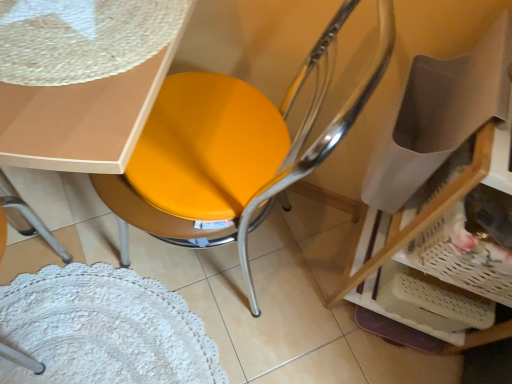
Question: From a real-world perspective, is white woven basket at lower right located higher than matte yellow seat at center?

Choices:
 (A) yes
 (B) no

Answer: (A)

Question: Does white woven basket at lower right have a larger size compared to matte yellow seat at center?

Choices:
 (A) yes
 (B) no

Answer: (B)

Question: Is white woven basket at lower right to the left of matte yellow seat at center from the viewer's perspective?

Choices:
 (A) no
 (B) yes

Answer: (A)

Question: Considering the relative sizes of white woven basket at lower right and matte yellow seat at center in the image provided, is white woven basket at lower right thinner than matte yellow seat at center?

Choices:
 (A) no
 (B) yes

Answer: (B)

Question: Could you tell me if white woven basket at lower right is facing matte yellow seat at center?

Choices:
 (A) no
 (B) yes

Answer: (A)

Question: Does white woven basket at lower right have a greater height compared to matte yellow seat at center?

Choices:
 (A) no
 (B) yes

Answer: (A)

Question: Is matte yellow seat at center at the left side of white woven basket at lower right?

Choices:
 (A) yes
 (B) no

Answer: (A)

Question: From a real-world perspective, is matte yellow seat at center under white woven basket at lower right?

Choices:
 (A) yes
 (B) no

Answer: (A)

Question: Is matte yellow seat at center not near white woven basket at lower right?

Choices:
 (A) no
 (B) yes

Answer: (A)

Question: Is matte yellow seat at center further to camera compared to white woven basket at lower right?

Choices:
 (A) no
 (B) yes

Answer: (A)

Question: From the image's perspective, is matte yellow seat at center on top of white woven basket at lower right?

Choices:
 (A) no
 (B) yes

Answer: (B)

Question: Is the surface of matte yellow seat at center in direct contact with white woven basket at lower right?

Choices:
 (A) yes
 (B) no

Answer: (B)

Question: Could you tell me if matte yellow seat at center is turned towards matte white table at upper left?

Choices:
 (A) yes
 (B) no

Answer: (A)